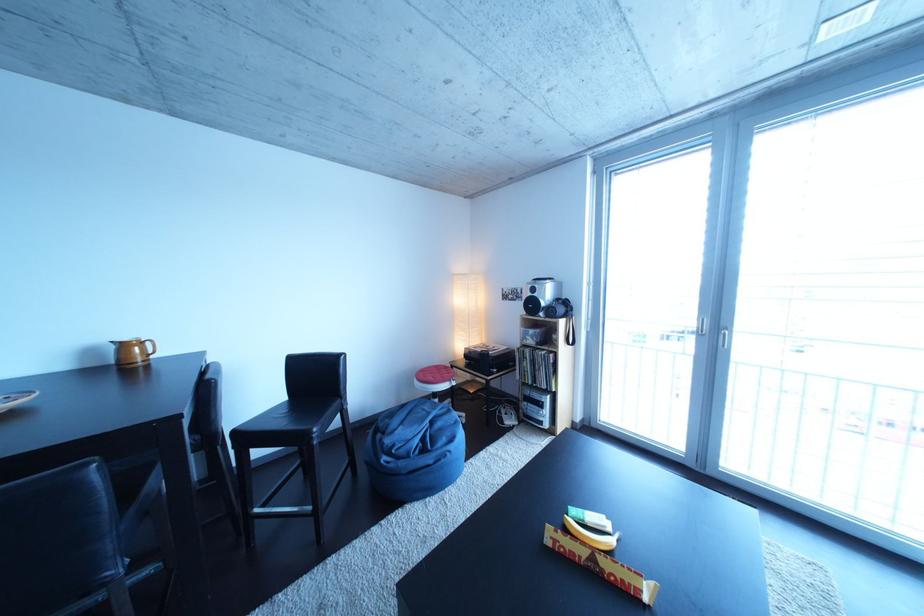
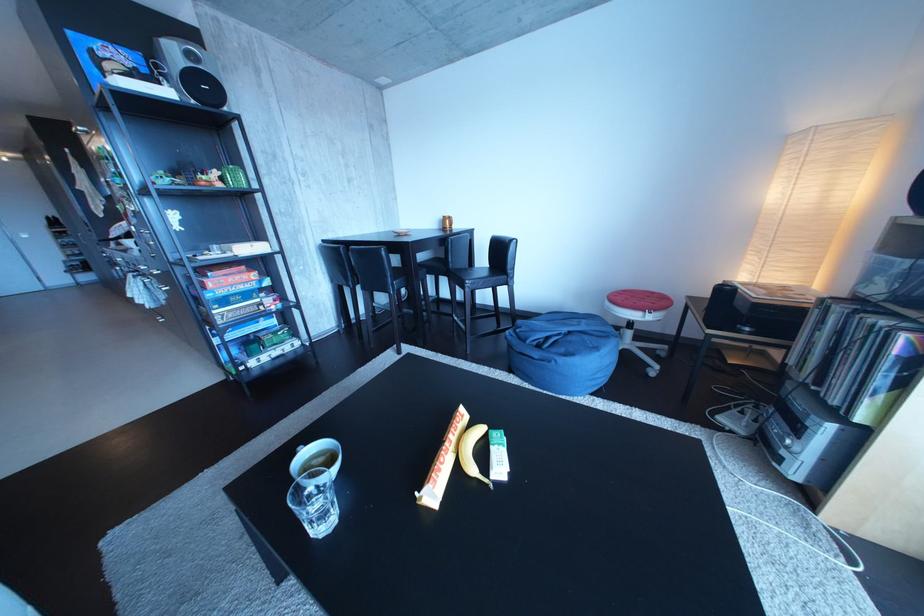
Where in the second image is the point corresponding to (x=299, y=403) from the first image?

(501, 272)